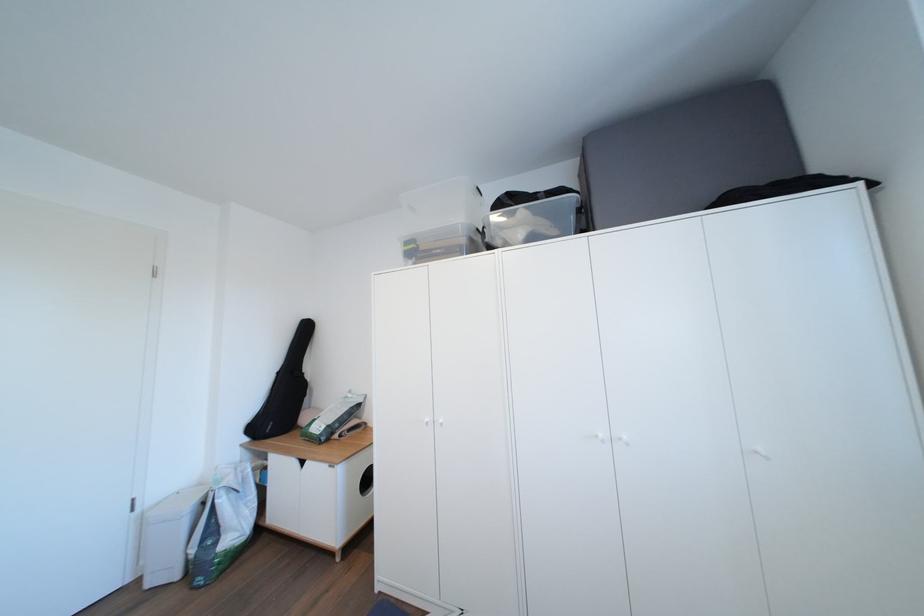
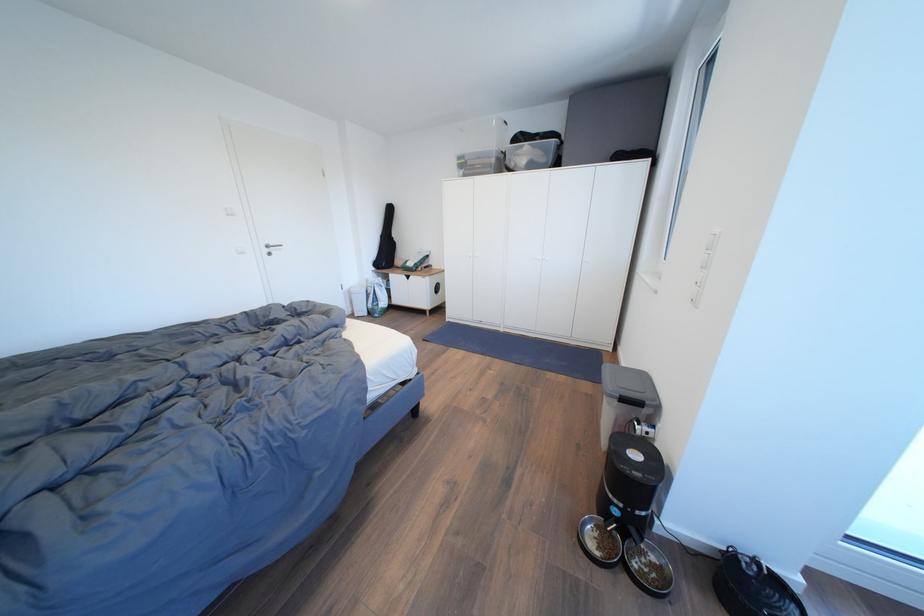
Question: What movement of the cameraman would produce the second image?

Choices:
 (A) Left
 (B) Right
 (C) Forward
 (D) Backward

Answer: (D)